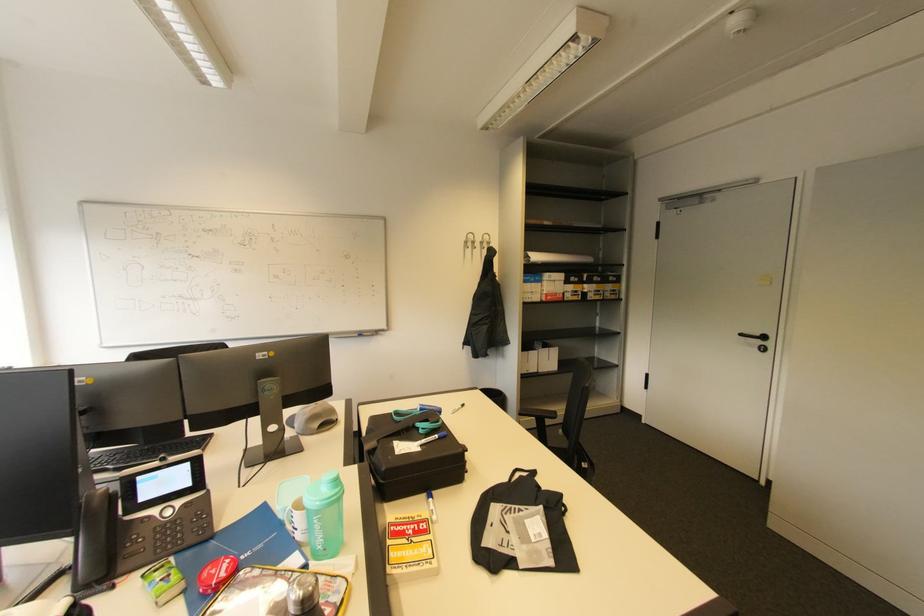
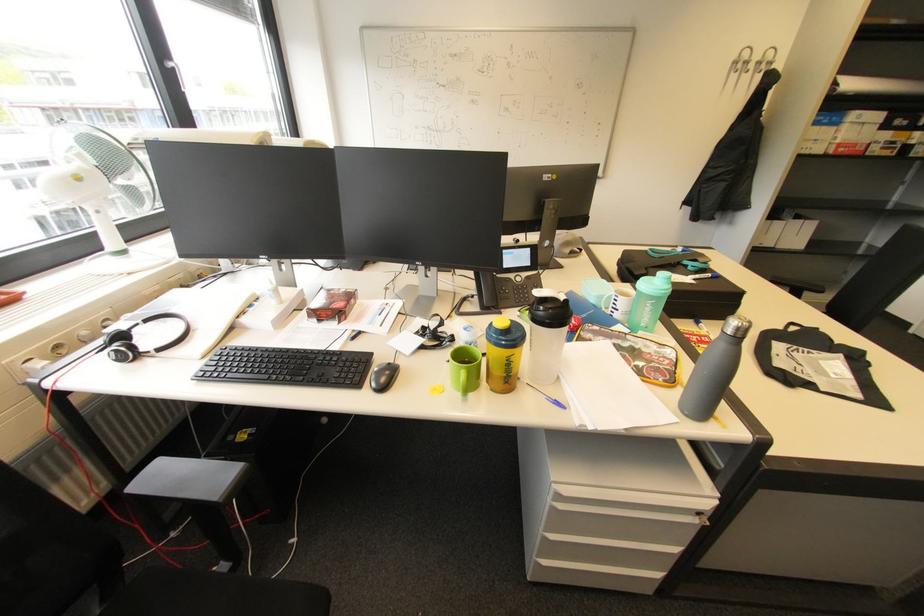
The point at (430, 528) is marked in the first image. Where is the corresponding point in the second image?

(713, 341)